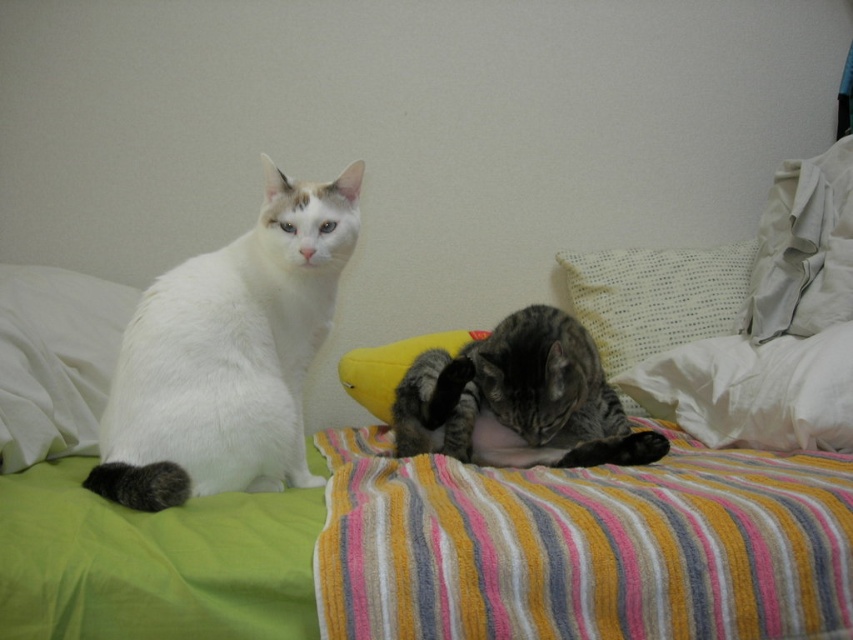
Does white soft pillow at right appear on the left side of white dotted pillow at upper right?

No, white soft pillow at right is not to the left of white dotted pillow at upper right.

The image size is (853, 640). Describe the element at coordinates (753, 390) in the screenshot. I see `white soft pillow at right` at that location.

Does point (759, 380) lie behind point (589, 275)?

No, it is in front of (589, 275).

The width and height of the screenshot is (853, 640). I want to click on white soft pillow at right, so click(753, 390).

Is white fluffy cat at left to the left of white dotted pillow at upper right from the viewer's perspective?

Correct, you'll find white fluffy cat at left to the left of white dotted pillow at upper right.

Does white fluffy cat at left appear on the right side of white dotted pillow at upper right?

Incorrect, white fluffy cat at left is not on the right side of white dotted pillow at upper right.

Identify the location of white fluffy cat at left. The width and height of the screenshot is (853, 640). (228, 355).

Image resolution: width=853 pixels, height=640 pixels. I want to click on white fluffy cat at left, so click(x=228, y=355).

Consider the image. Does tabby fur cat at center come behind white dotted pillow at upper right?

That is False.

Between point (463, 449) and point (722, 310), which one is positioned in front?

Positioned in front is point (463, 449).

Image resolution: width=853 pixels, height=640 pixels. Find the location of `tabby fur cat at center`. tabby fur cat at center is located at coordinates point(519,401).